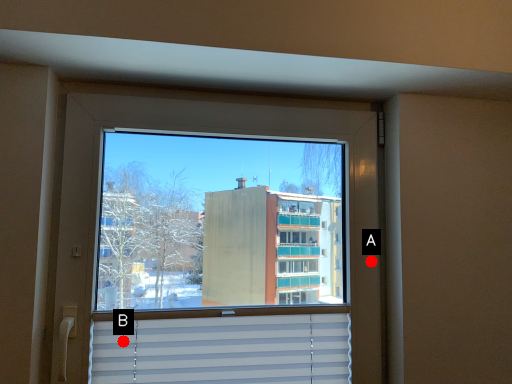
Question: Two points are circled on the image, labeled by A and B beside each circle. Among these points, which one is nearest to the camera?

Choices:
 (A) A is closer
 (B) B is closer

Answer: (B)